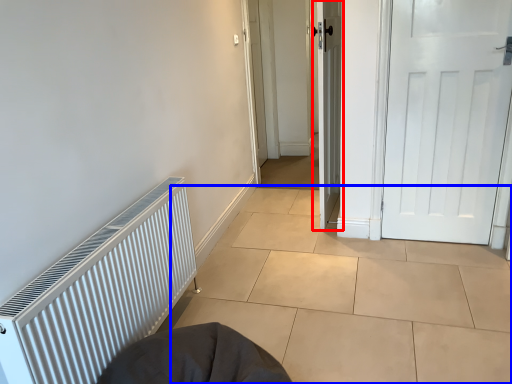
Question: Which point is closer to the camera, door (highlighted by a red box) or tile (highlighted by a blue box)?

Choices:
 (A) door
 (B) tile

Answer: (B)